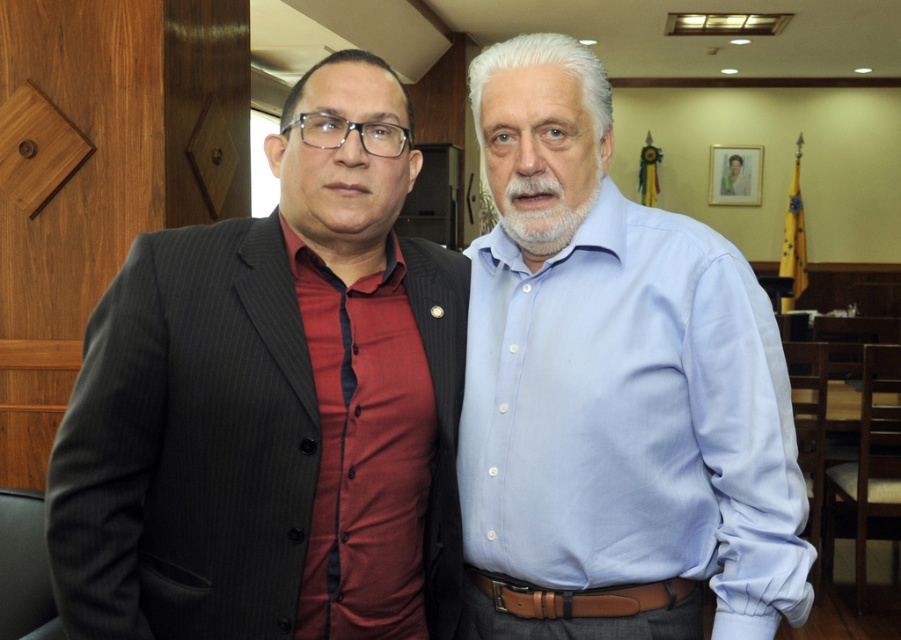
You are a photographer setting up for a formal portrait in the described scene. You need to position a light source between the two points labeled as point (672, 618) and point (233, 300). Which point should the light be closer to if you want it to be nearer to the viewer?

The light should be placed closer to point (672, 618) because it is further to the viewer than point (233, 300).

You are an event planner arranging seating for a formal dinner. You need to seat guests based on their attire. The light blue shirt at center and the matte black suit at left are both present. Which guest should be seated closer to the head table if seating is determined by who is more centrally positioned?

The light blue shirt at center should be seated closer to the head table because it is positioned over the matte black suit at left, indicating it is more centrally located.

You are a photographer setting up for a formal group photo. You need to ensure that all subjects are visible. Given that the light blue shirt at center and the matte black suit at left are part of the group, which subject might require more space in the frame to accommodate their clothing?

The light blue shirt at center is larger in size than the matte black suit at left, so the photographer should allocate more space in the frame for the light blue shirt at center to ensure it is fully visible.